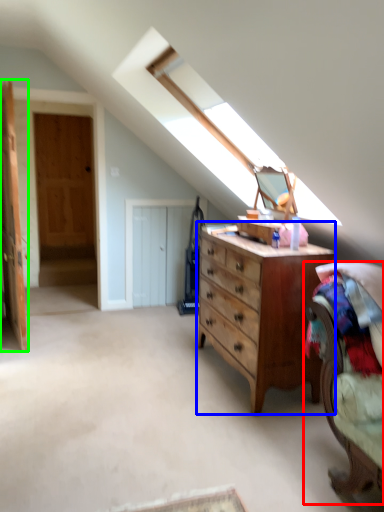
Question: Estimate the real-world distances between objects in this image. Which object is closer to armchair (highlighted by a red box), chest of drawers (highlighted by a blue box) or door (highlighted by a green box)?

Choices:
 (A) chest of drawers
 (B) door

Answer: (A)